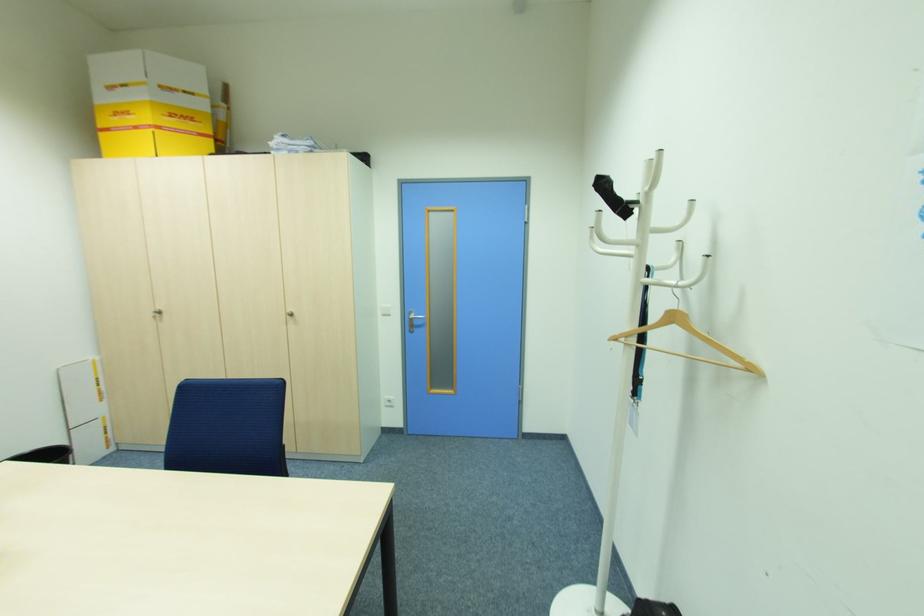
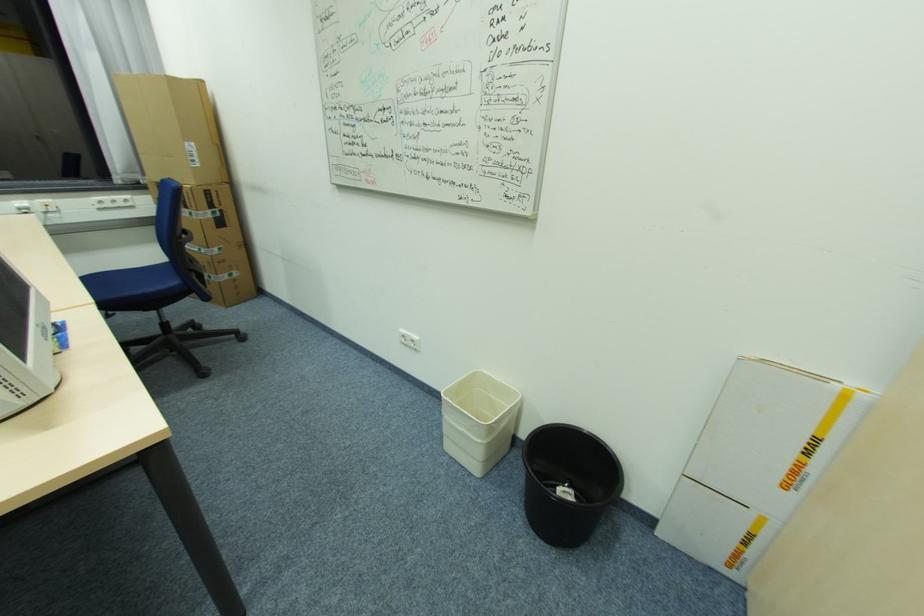
Where in the second image is the point corresponding to point (108, 427) from the first image?

(752, 535)